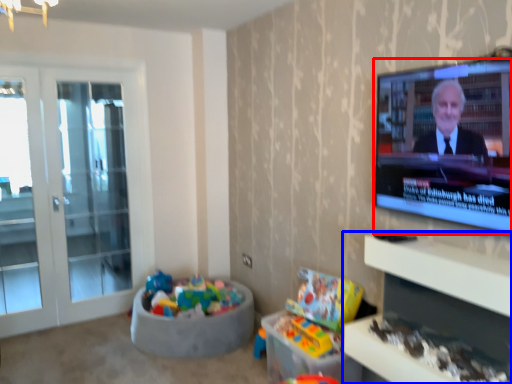
Question: Which point is further to the camera, television (highlighted by a red box) or entertainment center (highlighted by a blue box)?

Choices:
 (A) television
 (B) entertainment center

Answer: (A)